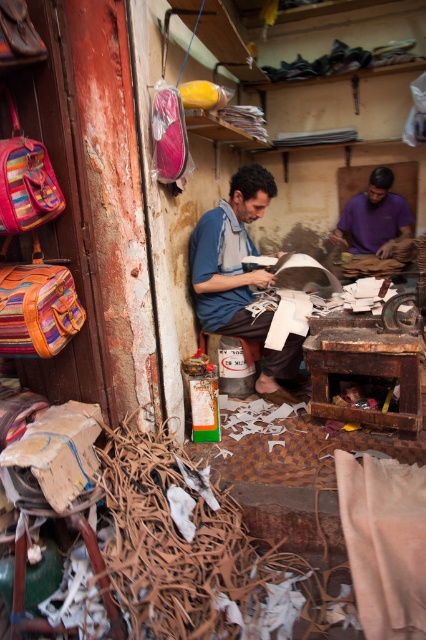
Looking at this image, can you confirm if blue fabric shirt at center is smaller than purple fabric at center?

No.

Which is more to the right, blue fabric shirt at center or purple fabric at center?

purple fabric at center is more to the right.

Image resolution: width=426 pixels, height=640 pixels. What do you see at coordinates (230, 259) in the screenshot? I see `blue fabric shirt at center` at bounding box center [230, 259].

I want to click on blue fabric shirt at center, so click(230, 259).

Is blue fabric shirt at center positioned in front of striped fabric backpack at left?

No, it is not.

Can you confirm if blue fabric shirt at center is shorter than striped fabric backpack at left?

No.

Between point (284, 371) and point (48, 177), which one is positioned in front?

Point (48, 177) is in front.

You are a GUI agent. You are given a task and a screenshot of the screen. Output one action in this format:
    pyautogui.click(x=<x>, y=<y>)
    Task: Click on the blue fabric shirt at center
    The image size is (426, 640).
    Given the screenshot: What is the action you would take?
    pyautogui.click(x=230, y=259)

Measure the distance between striped fabric backpack at left and camera.

The distance of striped fabric backpack at left from camera is 1.73 meters.

Based on the photo, who is more distant from viewer, (11, 228) or (371, 227)?

Positioned behind is point (371, 227).

Image resolution: width=426 pixels, height=640 pixels. In order to click on striped fabric backpack at left in this screenshot , I will do `click(25, 180)`.